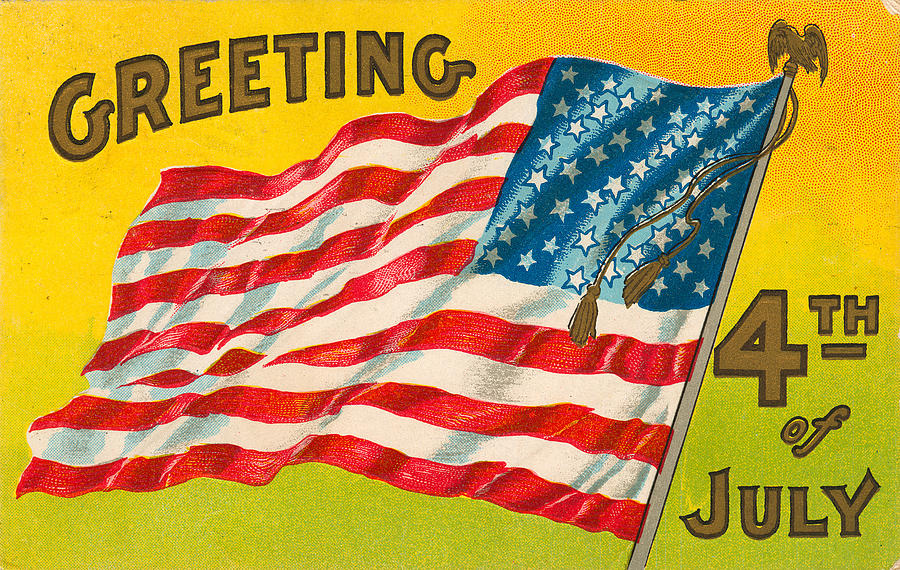
This screenshot has height=570, width=900. Identify the location of painting. (281, 504).